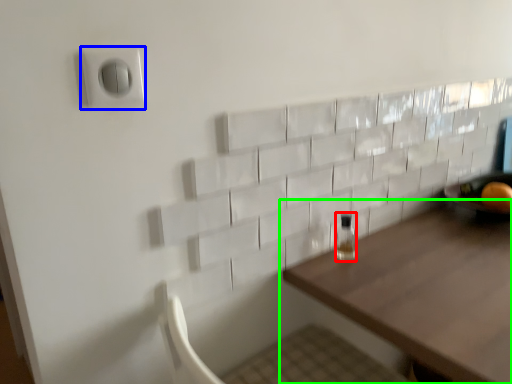
Question: Which object is positioned farthest from bottle (highlighted by a red box)? Select from electric outlet (highlighted by a blue box) and table (highlighted by a green box).

Choices:
 (A) electric outlet
 (B) table

Answer: (A)